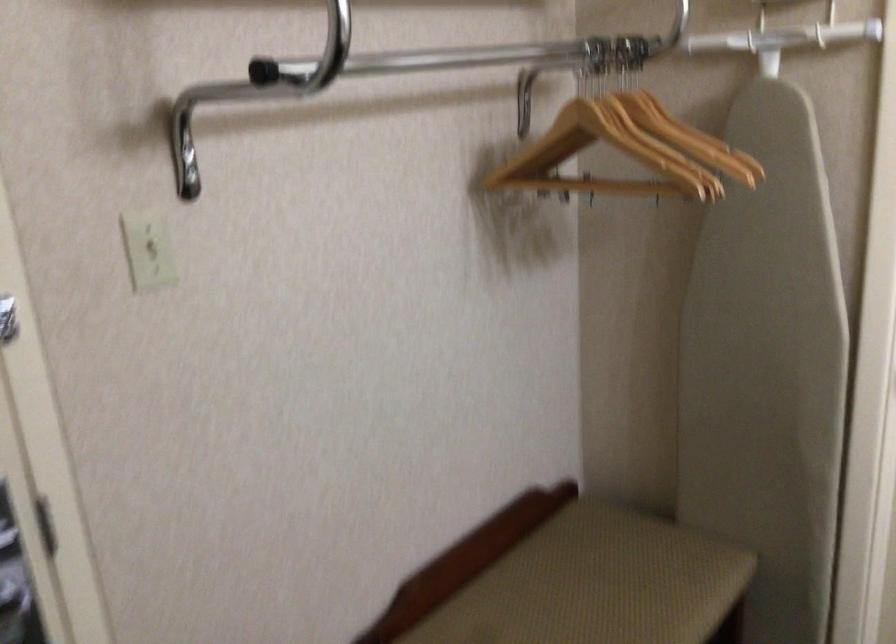
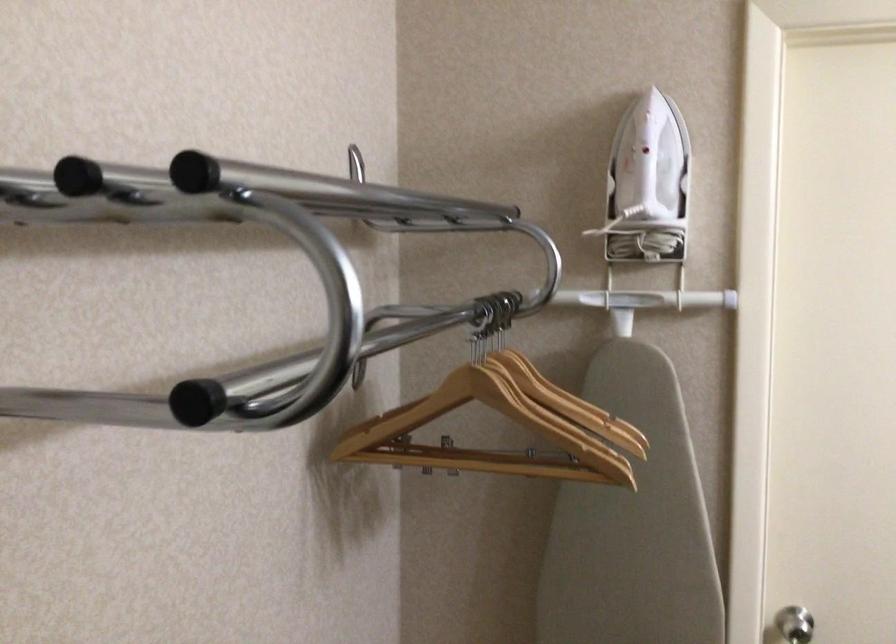
Find the pixel in the second image that matches point (764, 261) in the first image.

(633, 525)